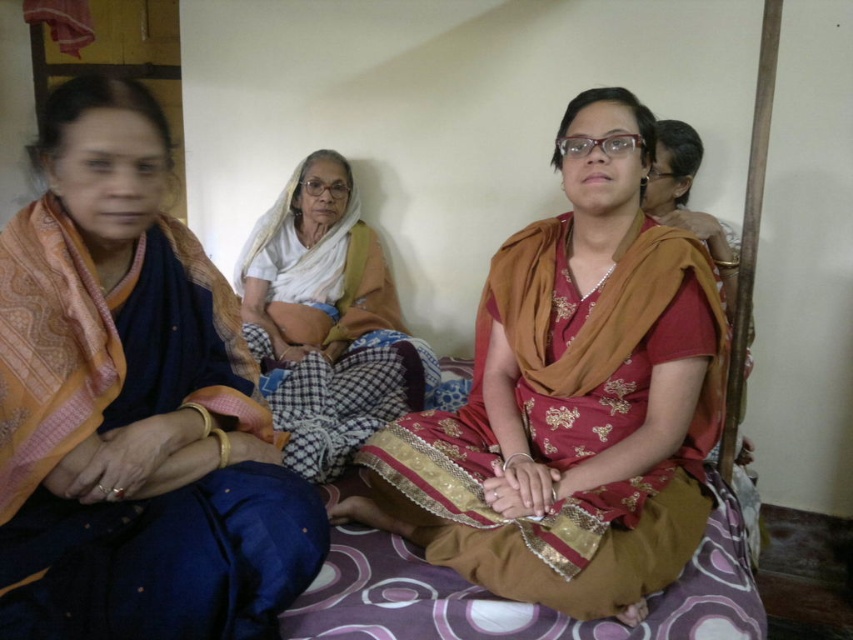
You are a tailor observing the two saris in the image. Which sari has a greater width between the matte brown sari at center and the white cotton saree at center?

The matte brown sari at center has a greater width than the white cotton saree at center according to the description.

In the scene described, two women are sitting in the center wearing different traditional garments. The matte brown sari at center and the white cotton saree at center are both present. Which garment is positioned to the right of the other?

The matte brown sari at center is to the right of the white cotton saree at center.